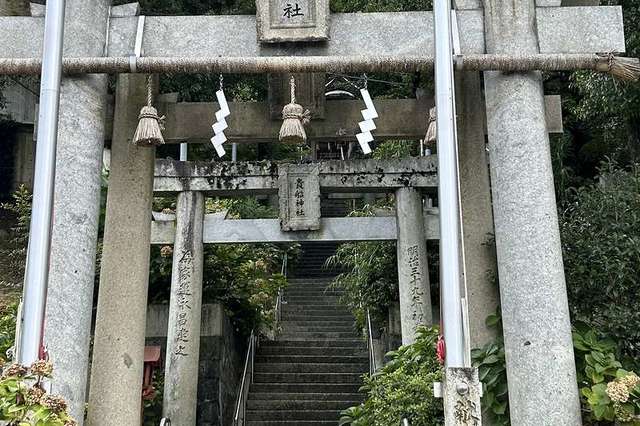
Find the location of a particular element. Image resolution: width=640 pixels, height=426 pixels. decorations is located at coordinates (367, 116), (290, 130), (218, 114), (148, 129).